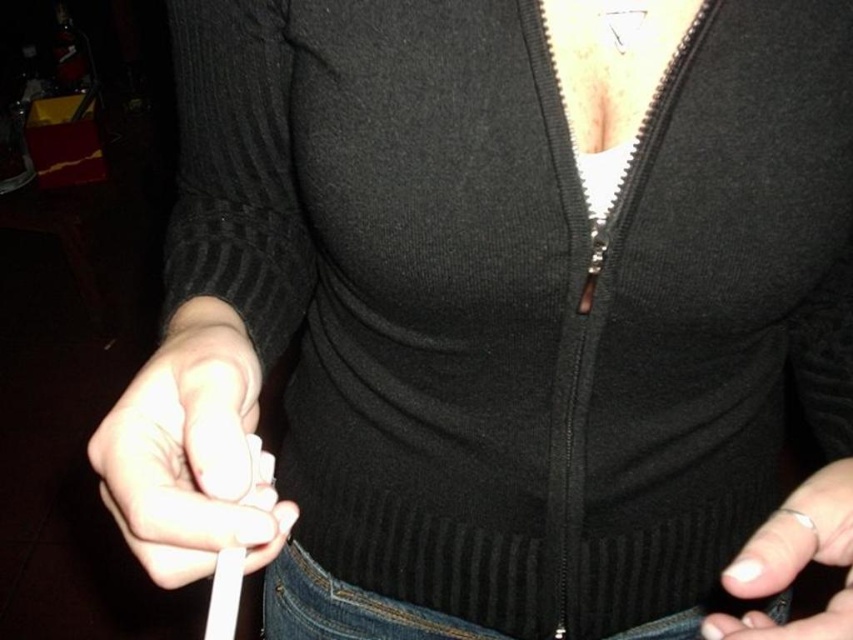
You are holding a white matte remote control at lower left and want to hand it to someone standing 12 inches away from you. Can you reach them without moving?

The white matte remote control at lower left is 10.90 inches from viewer, so yes, you can reach them since the distance is within your arm length.

From the picture: You are a delivery robot in a living room. You need to place a small package on the nearest flat surface. You see the white matte remote control at lower left and the white matte nail at lower right. Which object is closer to you?

The white matte remote control at lower left is closer to you because it has a lesser width compared to the white matte nail at lower right, indicating it is nearer in the scene.

You are a photographer adjusting the lighting in a dim room. You notice the white matte remote control at lower left and the white matte nail at lower right in your frame. Which object is closer to the camera?

The white matte remote control at lower left is closer to the camera because the white matte nail at lower right is behind it.